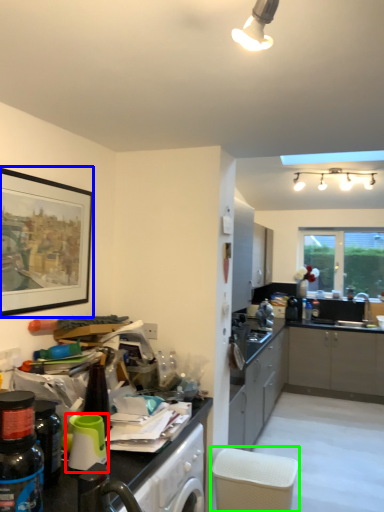
Question: Which is farther away from appliance (highlighted by a red box)? picture frame (highlighted by a blue box) or chair (highlighted by a green box)?

Choices:
 (A) picture frame
 (B) chair

Answer: (B)